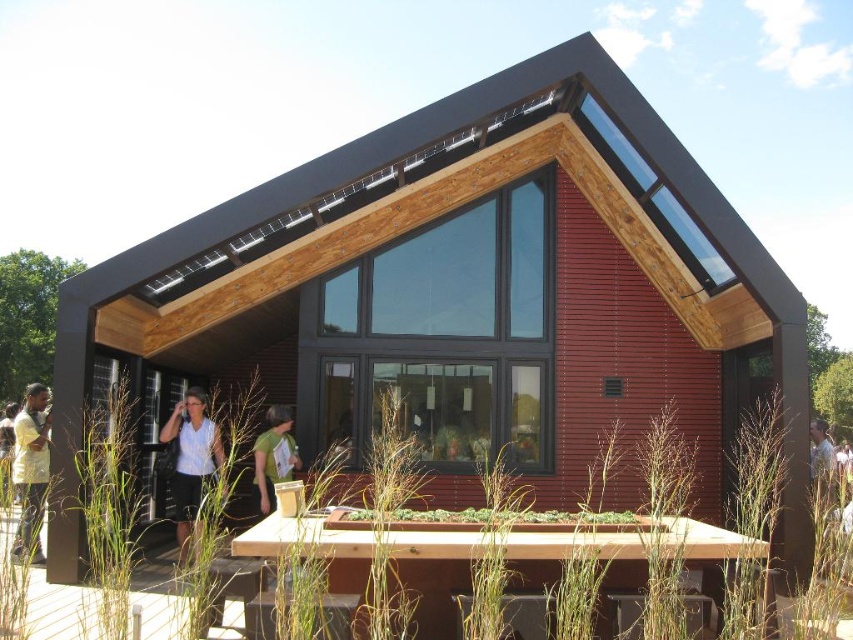
Which is more to the left, green fabric shirt at center or light brown shirt at center?

From the viewer's perspective, green fabric shirt at center appears more on the left side.

Which is above, green fabric shirt at center or light brown shirt at center?

green fabric shirt at center

What do you see at coordinates (274, 456) in the screenshot? The image size is (853, 640). I see `green fabric shirt at center` at bounding box center [274, 456].

I want to click on green fabric shirt at center, so click(x=274, y=456).

Looking at this image, how much distance is there between light yellow shirt at left and light brown shirt at center?

The distance of light yellow shirt at left from light brown shirt at center is 8.49 meters.

Measure the distance between point (x=26, y=493) and camera.

They are 25.15 feet apart.

Find the location of a particular element. The height and width of the screenshot is (640, 853). light yellow shirt at left is located at coordinates (32, 468).

Is matte white blouse at lower center to the right of green fabric shirt at center from the viewer's perspective?

No, matte white blouse at lower center is not to the right of green fabric shirt at center.

Does matte white blouse at lower center have a smaller size compared to green fabric shirt at center?

No.

Is point (184, 404) positioned in front of point (268, 483)?

Yes.

Locate an element on the screen. matte white blouse at lower center is located at coordinates (190, 461).